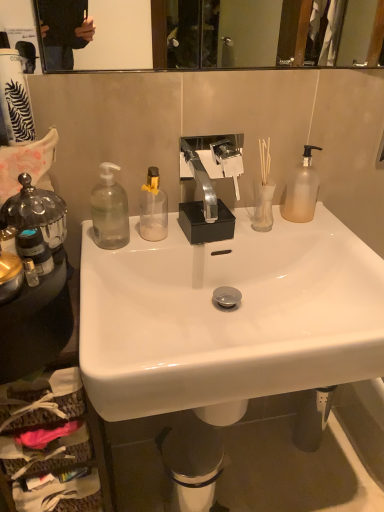
This screenshot has width=384, height=512. In order to click on vacant space to the right of translucent glass vase at center in this screenshot , I will do `click(320, 233)`.